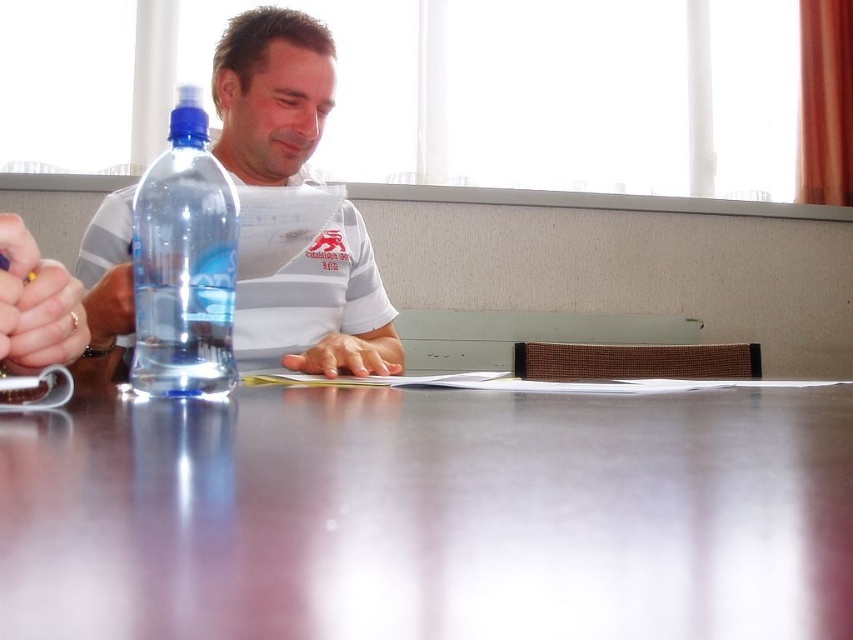
Looking at this image, which of these two, matte plastic water bottle at left or transparent plastic bottle at center, stands shorter?

Standing shorter between the two is transparent plastic bottle at center.

Who is lower down, matte plastic water bottle at left or transparent plastic bottle at center?

Positioned lower is transparent plastic bottle at center.

Locate an element on the screen. matte plastic water bottle at left is located at coordinates (321, 308).

Image resolution: width=853 pixels, height=640 pixels. Identify the location of matte plastic water bottle at left. (321, 308).

Between glossy plastic table at center and transparent plastic bottle at center, which one is positioned higher?

transparent plastic bottle at center

What are the coordinates of `glossy plastic table at center` in the screenshot? It's located at (431, 515).

Is glossy plastic table at center behind matte plastic water bottle at left?

No, glossy plastic table at center is closer to the viewer.

Locate an element on the screen. The height and width of the screenshot is (640, 853). glossy plastic table at center is located at coordinates (431, 515).

Find the location of a particular element. The image size is (853, 640). glossy plastic table at center is located at coordinates (431, 515).